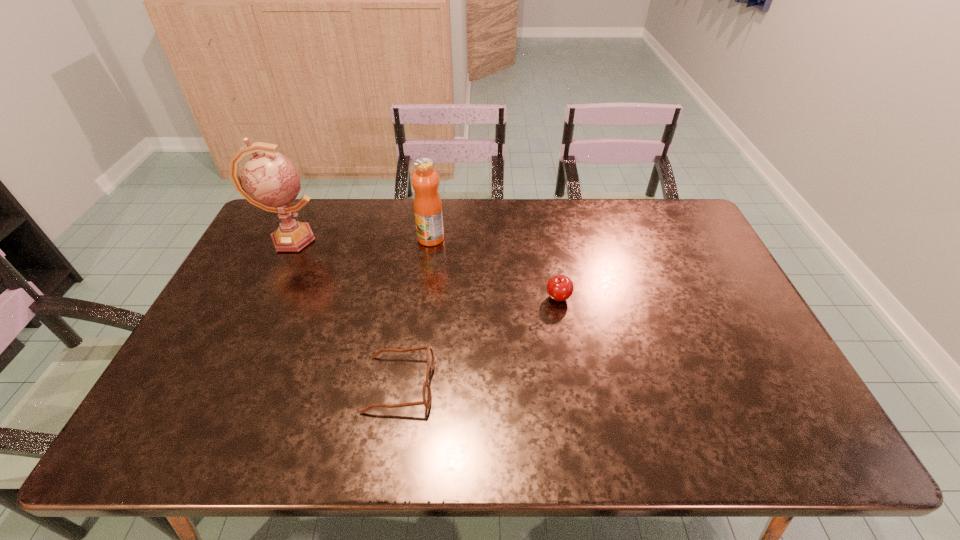
This screenshot has height=540, width=960. I want to click on free space located 0.180m on the front-facing side of the nearest object, so click(506, 383).

At what (x,y) coordinates should I click in order to perform the action: click on globe present at the far edge. Please return your answer as a coordinate pair (x, y). The height and width of the screenshot is (540, 960). Looking at the image, I should click on (269, 180).

In order to click on fruit juice present at the far edge in this screenshot , I will do `click(427, 204)`.

Identify the location of object located at the left edge. (269, 180).

This screenshot has width=960, height=540. Find the location of `object situated at the far left corner`. object situated at the far left corner is located at coordinates (269, 180).

This screenshot has width=960, height=540. What are the coordinates of `free location at the far edge` in the screenshot? It's located at (647, 224).

In the image, there is a desktop. Where is `vacant space at the left edge`? vacant space at the left edge is located at coordinates click(223, 414).

This screenshot has width=960, height=540. I want to click on free space at the right edge of the desktop, so click(x=763, y=359).

Where is `vacant space at the far left corner of the desktop`? Image resolution: width=960 pixels, height=540 pixels. vacant space at the far left corner of the desktop is located at coordinates (318, 206).

Locate an element on the screen. The image size is (960, 540). vacant point located between the tallest object and the second tallest object is located at coordinates (361, 239).